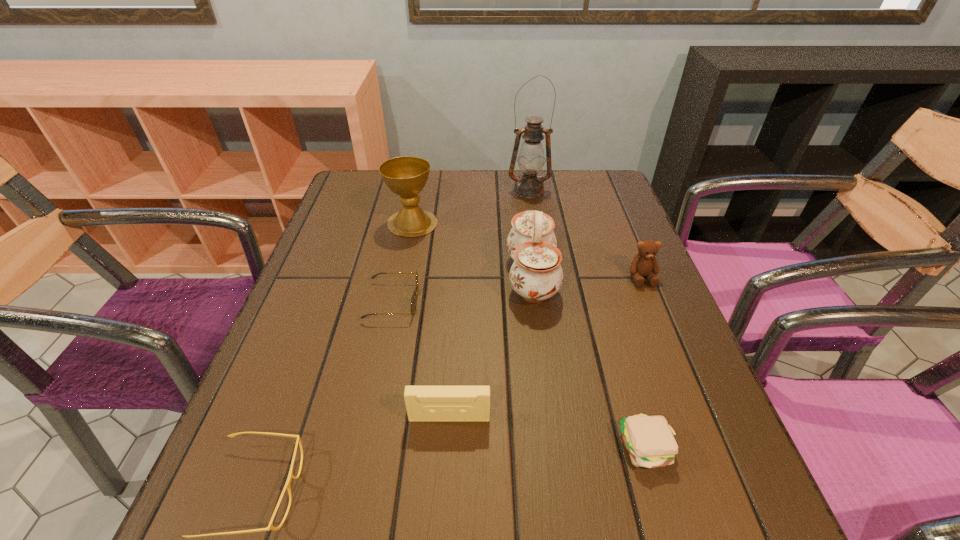
Where is `vacant space located by the handle of the chinaware`? vacant space located by the handle of the chinaware is located at coordinates (445, 277).

Locate an element on the screen. The height and width of the screenshot is (540, 960). vacant space located 0.300m by the handle of the chinaware is located at coordinates (375, 277).

You are a GUI agent. You are given a task and a screenshot of the screen. Output one action in this format:
    pyautogui.click(x=<x>, y=<y>)
    Task: Click on the vacant space located 0.170m by the handle of the chinaware
    The height and width of the screenshot is (540, 960).
    Given the screenshot: What is the action you would take?
    pyautogui.click(x=433, y=277)

This screenshot has height=540, width=960. Identify the location of vacant region located on the left of the second farthest object. (346, 223).

The width and height of the screenshot is (960, 540). I want to click on free region located on the face of the teddy bear, so click(x=670, y=348).

Identify the location of free point located 0.050m at the front of the fourth shortest object with spools. This screenshot has width=960, height=540. pyautogui.click(x=447, y=453).

This screenshot has height=540, width=960. I want to click on vacant space located 0.070m on the lenses of the sunglasses, so click(x=451, y=301).

The image size is (960, 540). What are the coordinates of `vacant position located 0.060m on the back of the seventh object from left to right` in the screenshot? It's located at (630, 390).

The width and height of the screenshot is (960, 540). In order to click on oil lamp that is at the far edge in this screenshot , I will do `click(531, 159)`.

Identify the location of chalice present at the far edge. (406, 176).